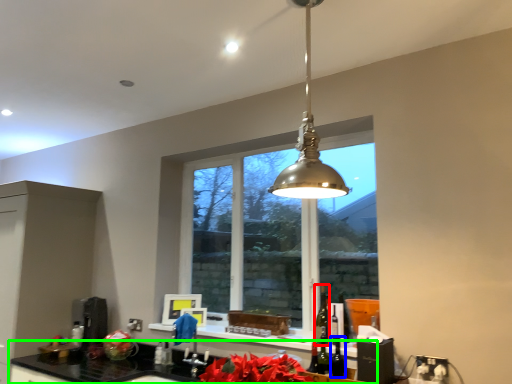
Question: Which is nearer to the alcohol (highlighted by a red box)? wine (highlighted by a blue box) or countertop (highlighted by a green box).

Choices:
 (A) wine
 (B) countertop

Answer: (A)